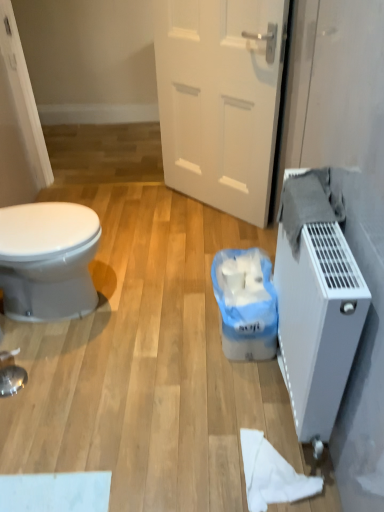
Question: In the image, is white plastic bag at lower center positioned in front of or behind white plastic radiator at right?

Choices:
 (A) front
 (B) behind

Answer: (B)

Question: From their relative heights in the image, would you say white plastic bag at lower center is taller or shorter than white plastic radiator at right?

Choices:
 (A) short
 (B) tall

Answer: (A)

Question: Estimate the real-world distances between objects in this image. Which object is farther from the white matte door at center?

Choices:
 (A) white plastic bag at lower center
 (B) white plastic radiator at right
 (C) white matte toilet paper at lower right

Answer: (C)

Question: Considering the real-world distances, which object is closest to the white matte door at center?

Choices:
 (A) white plastic bag at lower center
 (B) white plastic radiator at right
 (C) white matte toilet paper at lower right

Answer: (A)